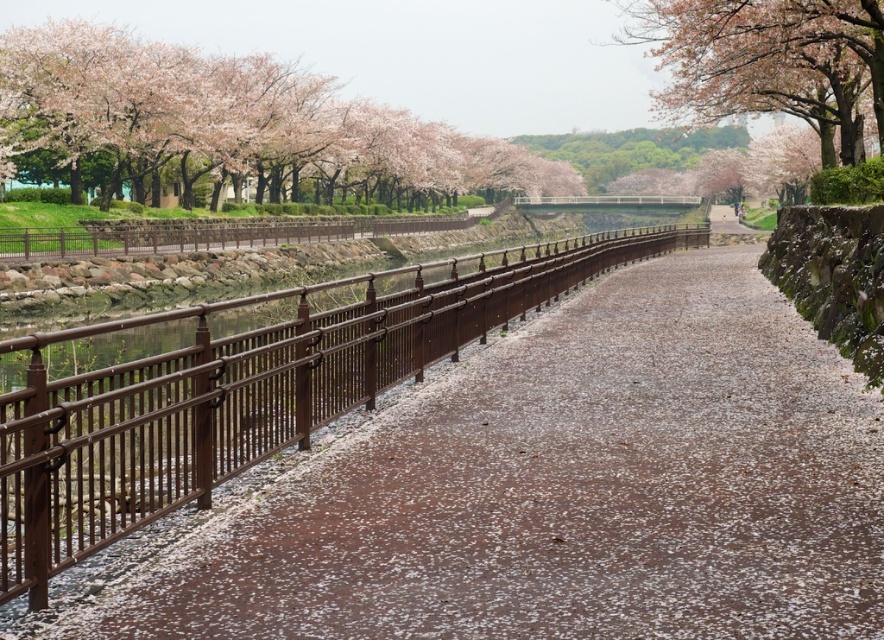
Question: Which point is farther to the camera?

Choices:
 (A) pink blossoms at upper left
 (B) white gravel path at center
 (C) brown metallic railing at left

Answer: (B)

Question: Does pink blossoms at upper left lie behind pink blossom tree at upper right?

Choices:
 (A) no
 (B) yes

Answer: (B)

Question: Which object appears closest to the camera in this image?

Choices:
 (A) brown metallic railing at left
 (B) pink blossom tree at upper right

Answer: (A)

Question: Considering the relative positions of brown metallic railing at left and pink blossom tree at upper right in the image provided, where is brown metallic railing at left located with respect to pink blossom tree at upper right?

Choices:
 (A) above
 (B) below

Answer: (B)

Question: Is brown metallic railing at left behind white gravel path at center?

Choices:
 (A) no
 (B) yes

Answer: (A)

Question: Among these objects, which one is nearest to the camera?

Choices:
 (A) white gravel path at center
 (B) brown metallic railing at left
 (C) pink blossoms at upper left

Answer: (B)